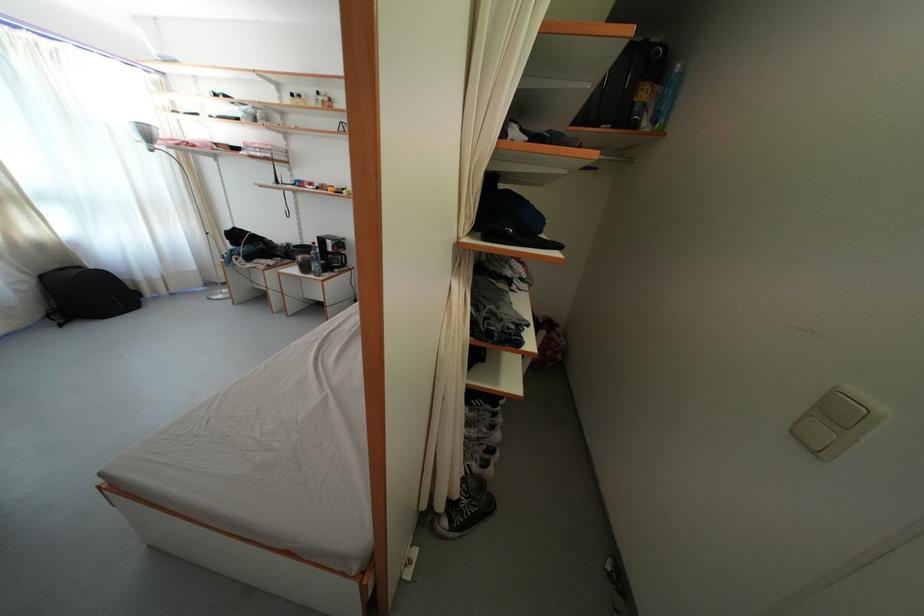
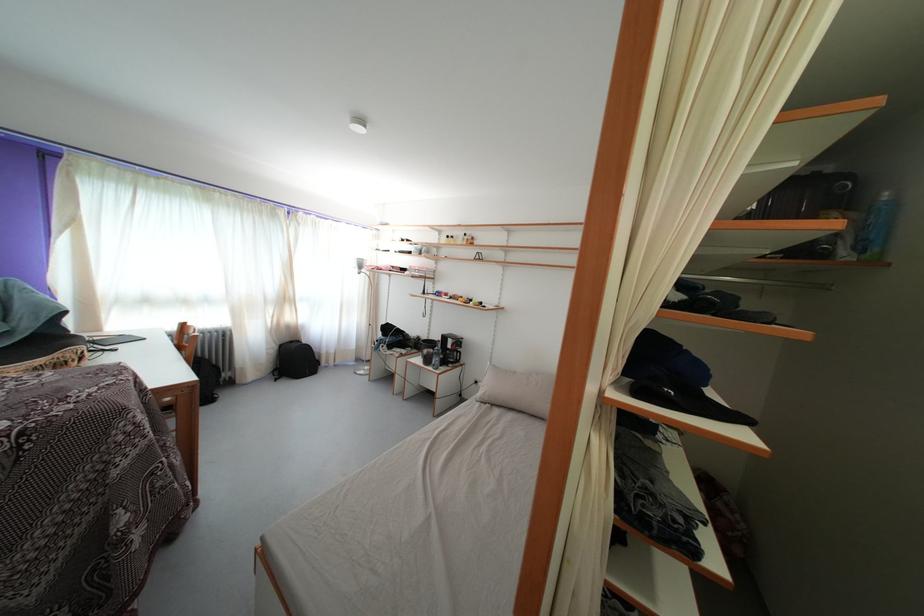
Consider the image. The first image is from the beginning of the video and the second image is from the end. How did the camera likely rotate when shooting the video?

A: The camera rotated toward left-up.